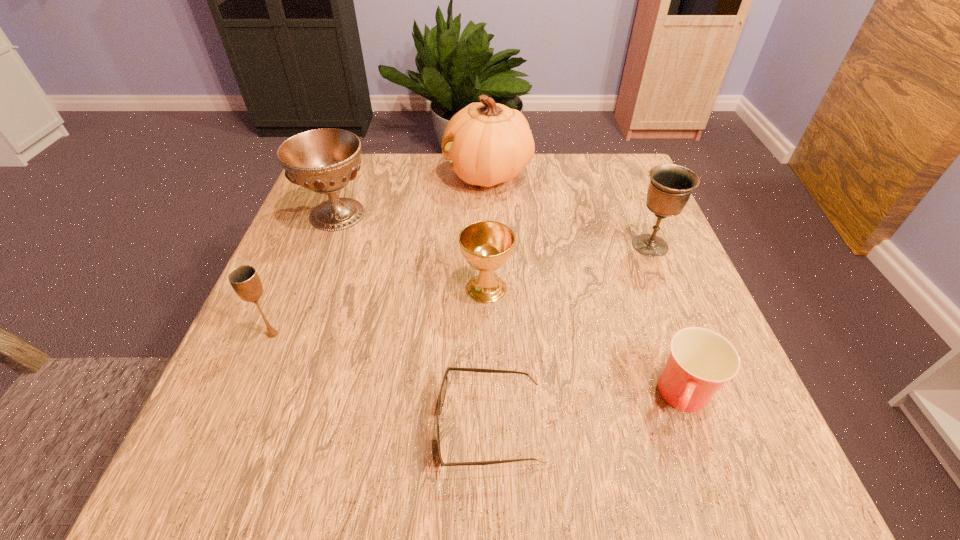
You are a GUI agent. You are given a task and a screenshot of the screen. Output one action in this format:
    pyautogui.click(x=<x>, y=<y>)
    Task: Click on the chalice located in the right edge section of the desktop
    Image resolution: width=960 pixels, height=540 pixels.
    Given the screenshot: What is the action you would take?
    pyautogui.click(x=670, y=187)

I want to click on cup situated at the right edge, so click(700, 361).

In order to click on object that is at the far left corner in this screenshot , I will do `click(325, 160)`.

Locate an element on the screen. The height and width of the screenshot is (540, 960). free space at the far edge of the desktop is located at coordinates (563, 202).

In the image, there is a desktop. Identify the location of vacant space at the near edge. Image resolution: width=960 pixels, height=540 pixels. (510, 467).

Locate an element on the screen. free region at the left edge of the desktop is located at coordinates (203, 434).

This screenshot has height=540, width=960. Identify the location of free location at the right edge. (687, 433).

You are a GUI agent. You are given a task and a screenshot of the screen. Output one action in this format:
    pyautogui.click(x=<x>, y=<y>)
    Task: Click on the blank space at the far left corner of the desktop
    The image size is (960, 540).
    Given the screenshot: What is the action you would take?
    pyautogui.click(x=362, y=197)

Identify the location of vacant space at the near left corner of the desktop. point(276,496).

Identify the location of free space at the far right corner. The height and width of the screenshot is (540, 960). (616, 177).